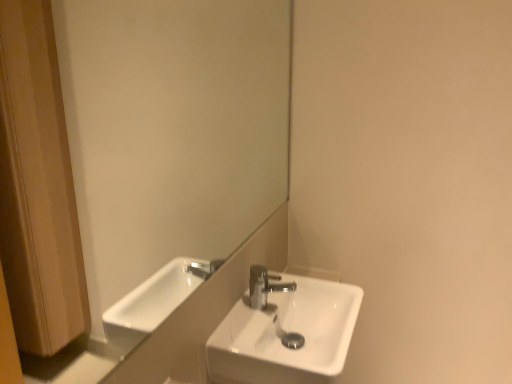
Locate an element on the screen. This screenshot has height=384, width=512. white ceramic sink at center is located at coordinates (286, 330).

Measure the distance between white ceramic sink at center and camera.

38.82 inches.

The width and height of the screenshot is (512, 384). What do you see at coordinates (286, 330) in the screenshot?
I see `white ceramic sink at center` at bounding box center [286, 330].

Find the location of a particular element. The height and width of the screenshot is (384, 512). white ceramic sink at center is located at coordinates click(286, 330).